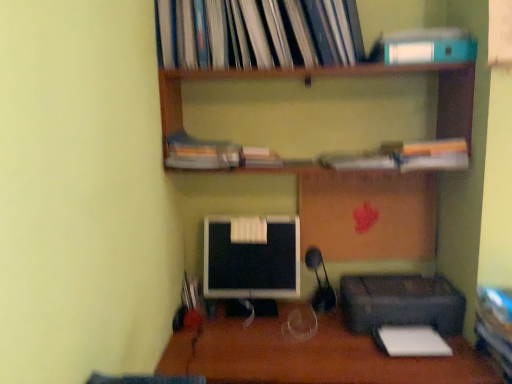
This screenshot has width=512, height=384. Identify the location of vacant space to the left of black plastic printer at lower right. (290, 344).